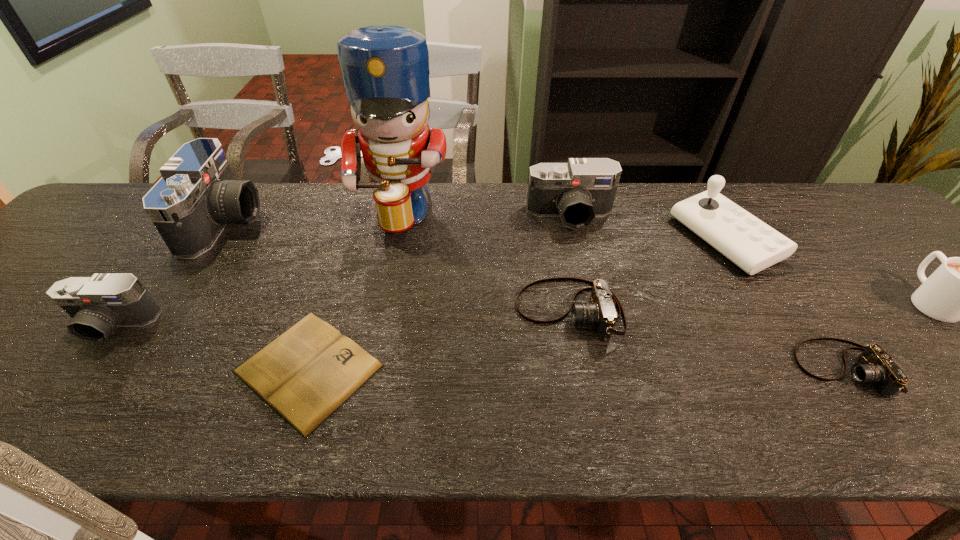
Find the location of `free space that satisfies the following two spatial constraints: 1. on the front-facing side of the joystick; 2. on the left side of the biggest black camera`. free space that satisfies the following two spatial constraints: 1. on the front-facing side of the joystick; 2. on the left side of the biggest black camera is located at coordinates (215, 239).